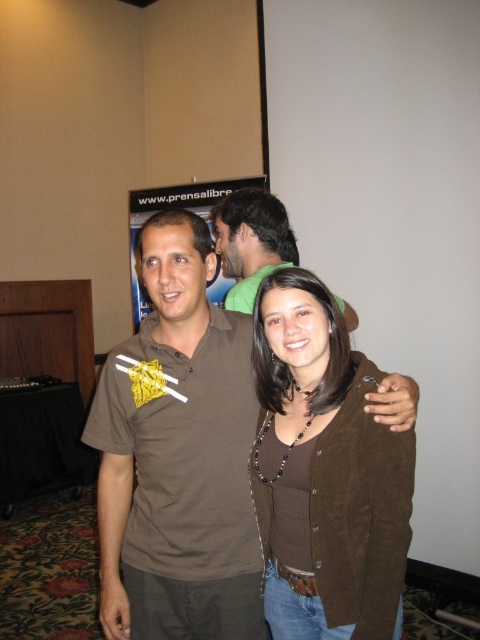
You are a fashion stylist trying to decide which item to feature in a magazine layout. You have the brown suede cardigan at center and the brown cotton shirt at center. If you want to highlight a slimmer silhouette, which item should you choose?

The brown suede cardigan at center is thinner than the brown cotton shirt at center, so it would be the better choice for highlighting a slimmer silhouette.

You are a photographer trying to focus on the person wearing the brown suede cardigan at center and the brown cotton shirt at center. Which one should you adjust your camera focus to prioritize if you want to capture the closer object clearly?

The brown suede cardigan at center is closer to the viewer than the brown cotton shirt at center, so you should prioritize focusing on the brown suede cardigan at center to capture it clearly.

You are a photographer trying to adjust the lighting between the brown suede shirt at center and the brown suede cardigan at center. Since they are both brown, you need to ensure they are evenly lit. Which object is closer to the left side so you can adjust the light accordingly?

The brown suede shirt at center is positioned on the left side of brown suede cardigan at center, so it is closer to the left side. Adjust the lighting starting from there.